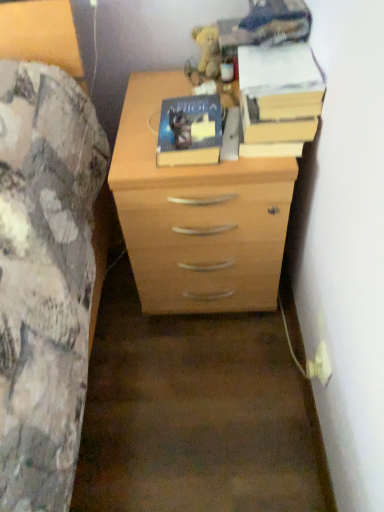
Question: Is yellow paper at upper right, positioned as the 1th paperback book in right-to-left order, facing away from fuzzy yellow plush at upper center?

Choices:
 (A) yes
 (B) no

Answer: (B)

Question: From a real-world perspective, is yellow paper at upper right, positioned as the 1th paperback book in right-to-left order, physically above fuzzy yellow plush at upper center?

Choices:
 (A) no
 (B) yes

Answer: (A)

Question: Is yellow paper at upper right, which is counted as the 2th paperback book, starting from the left, outside of fuzzy yellow plush at upper center?

Choices:
 (A) yes
 (B) no

Answer: (A)

Question: From the image's perspective, is yellow paper at upper right, positioned as the 1th paperback book in right-to-left order, located beneath fuzzy yellow plush at upper center?

Choices:
 (A) no
 (B) yes

Answer: (B)

Question: Could you tell me if yellow paper at upper right, positioned as the 1th paperback book in right-to-left order, is turned towards fuzzy yellow plush at upper center?

Choices:
 (A) no
 (B) yes

Answer: (A)

Question: Can white plastic plug at lower right be found inside yellow paper at upper right, which is counted as the 2th paperback book, starting from the left?

Choices:
 (A) yes
 (B) no

Answer: (B)

Question: Is yellow paper at upper right, which is counted as the 2th paperback book, starting from the left, turned away from white plastic plug at lower right?

Choices:
 (A) no
 (B) yes

Answer: (A)

Question: Does yellow paper at upper right, positioned as the 1th paperback book in right-to-left order, have a greater width compared to white plastic plug at lower right?

Choices:
 (A) yes
 (B) no

Answer: (A)

Question: Can you confirm if yellow paper at upper right, which is counted as the 2th paperback book, starting from the left, is shorter than white plastic plug at lower right?

Choices:
 (A) no
 (B) yes

Answer: (B)

Question: Considering the relative positions of yellow paper at upper right, positioned as the 1th paperback book in right-to-left order, and white plastic plug at lower right in the image provided, is yellow paper at upper right, positioned as the 1th paperback book in right-to-left order, to the right of white plastic plug at lower right from the viewer's perspective?

Choices:
 (A) no
 (B) yes

Answer: (A)

Question: From a real-world perspective, is yellow paper at upper right, positioned as the 1th paperback book in right-to-left order, beneath white plastic plug at lower right?

Choices:
 (A) no
 (B) yes

Answer: (A)

Question: Is hardcover book at center, which appears as the first paperback book when viewed from the left, further to camera compared to white plastic plug at lower right?

Choices:
 (A) no
 (B) yes

Answer: (A)